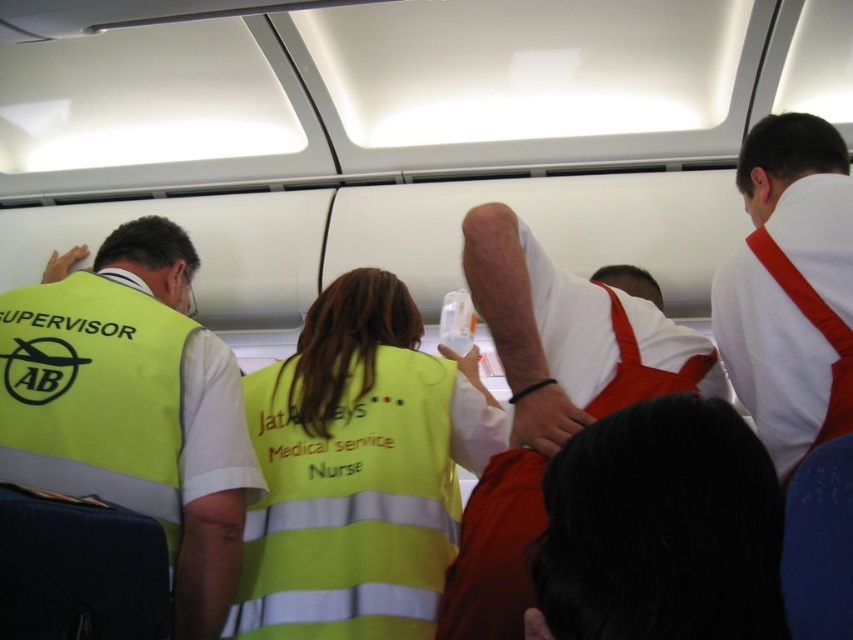
You are a passenger on this airplane and you want to locate the supervisor wearing the yellow reflective vest at left. Where should you look based on the coordinates provided?

The yellow reflective vest at left is located at point (132, 404).

You are a passenger on an airplane and want to locate the nearest medical staff member. You see the yellow reflective vest at left and the white cotton shirt at upper center. Which one is closer to you?

The yellow reflective vest at left is closer to you because it is further to the viewer than the white cotton shirt at upper center.